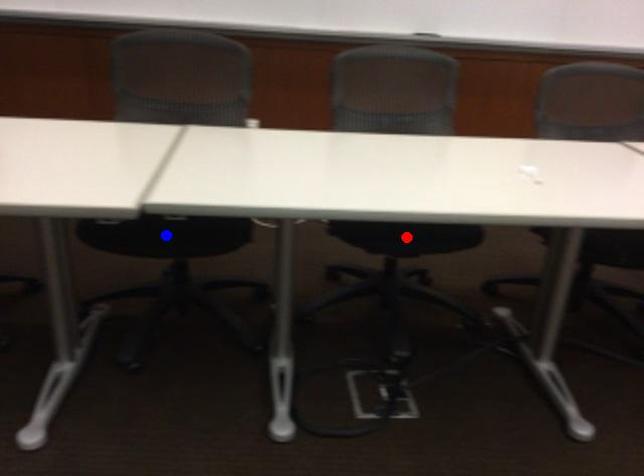
Question: Two points are marked on the image. Which point is closer to the camera?

Choices:
 (A) Blue point is closer.
 (B) Red point is closer.

Answer: (A)